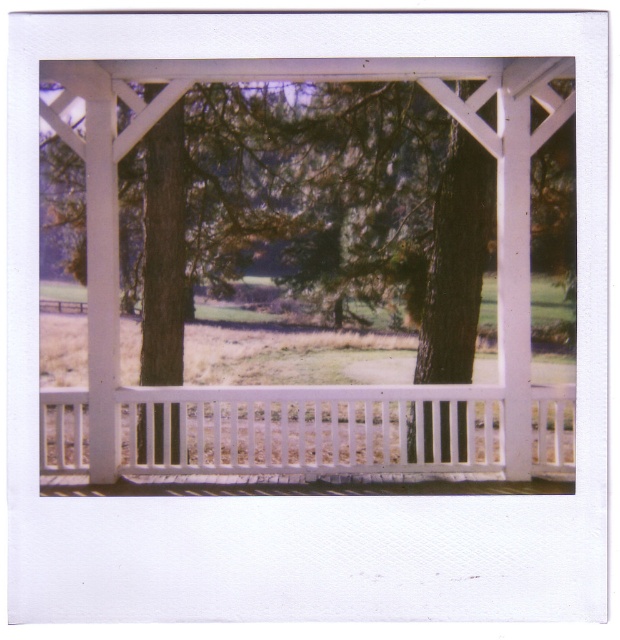
You are designing a garden layout and need to place a small bench between the white painted wood pergola at center and the white wooden railing at center. Which object should the bench be placed closer to if you want it to fit snugly without blocking the pathway? Please explain your reasoning based on their widths.

The bench should be placed closer to the white painted wood pergola at center because it is thinner than the white wooden railing at center. This allows the bench to fit snugly near the narrower structure while keeping the pathway clear around the wider railing.

You are a visitor at this location and want to take a photo of the white painted wood pergola at center and the white wooden railing at center. Which one should you focus on if you want to capture the larger object in your shot?

The white painted wood pergola at center has a larger size compared to the white wooden railing at center, so you should focus on the white painted wood pergola at center to capture the larger object in your shot.